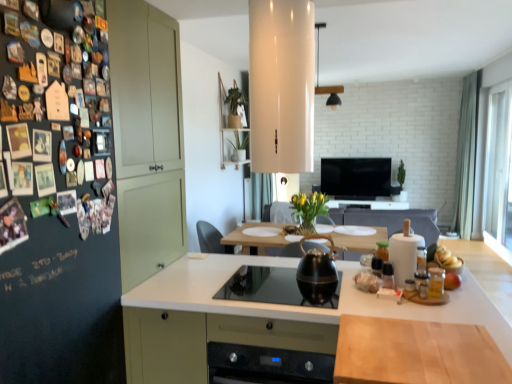
The image size is (512, 384). In order to click on free space on the front side of shiny black kettle at center in this screenshot , I will do `click(324, 295)`.